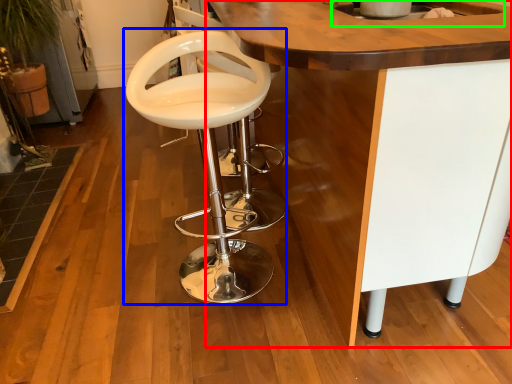
Question: Which is nearer to the table (highlighted by a red box)? chair (highlighted by a blue box) or sink (highlighted by a green box).

Choices:
 (A) chair
 (B) sink

Answer: (B)